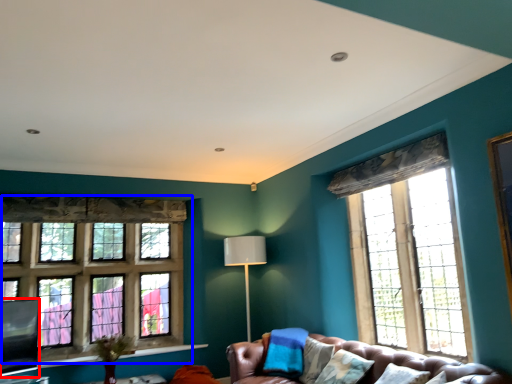
Question: Which of the following is the farthest to the observer, window screen (highlighted by a red box) or window (highlighted by a blue box)?

Choices:
 (A) window screen
 (B) window

Answer: (B)